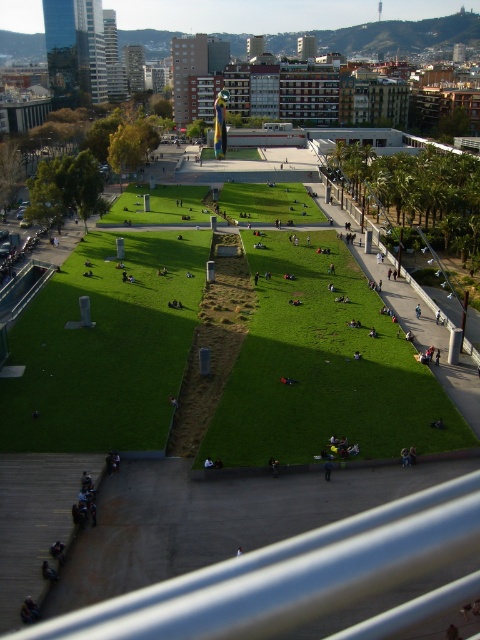
Question: Which of the following is the closest to the observer?

Choices:
 (A) (328, 465)
 (B) (240, 550)

Answer: (B)

Question: Can you confirm if dark blue jacket at lower center is bigger than smooth black shirt at center?

Choices:
 (A) yes
 (B) no

Answer: (A)

Question: Which of the following is the closest to the observer?

Choices:
 (A) (332, 465)
 (B) (241, 548)

Answer: (B)

Question: Does dark blue jacket at lower center appear on the left side of smooth black shirt at center?

Choices:
 (A) yes
 (B) no

Answer: (B)

Question: Does dark blue jacket at lower center have a smaller size compared to smooth black shirt at center?

Choices:
 (A) no
 (B) yes

Answer: (A)